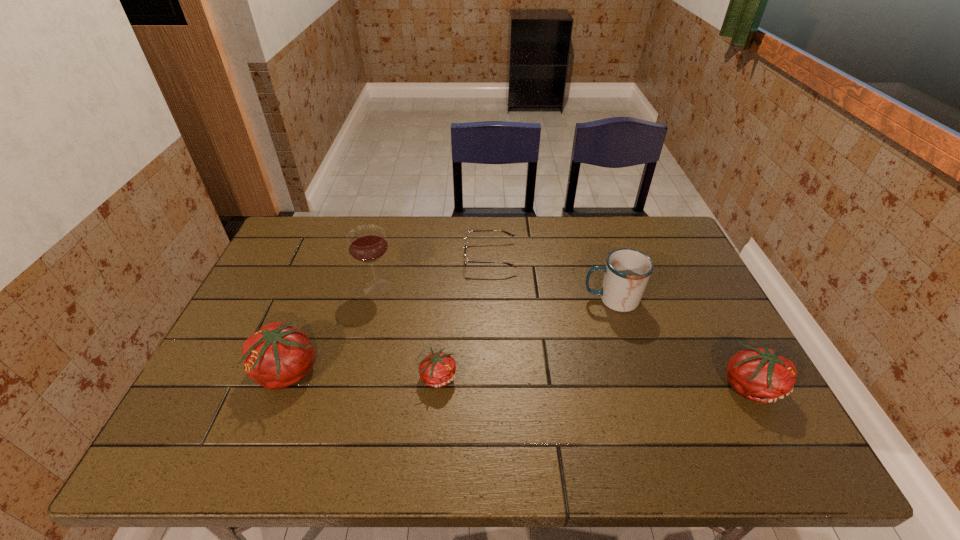
The image size is (960, 540). Find the location of `free space between the rightmost tomato and the farthest object`. free space between the rightmost tomato and the farthest object is located at coordinates (620, 321).

Identify the location of free area in between the second tomato from left to right and the leftmost tomato. (363, 374).

You are a GUI agent. You are given a task and a screenshot of the screen. Output one action in this format:
    pyautogui.click(x=<x>, y=<y>)
    Task: Click on the free spot between the rightmost object and the farthest object
    
    Given the screenshot: What is the action you would take?
    pyautogui.click(x=620, y=321)

Image resolution: width=960 pixels, height=540 pixels. I want to click on free space between the shortest tomato and the fourth object from left to right, so click(465, 316).

The image size is (960, 540). I want to click on free point between the fifth object from right to left and the fifth object from left to right, so click(494, 293).

Locate an element on the screen. This screenshot has height=540, width=960. vacant area between the mug and the third shortest object is located at coordinates (681, 342).

Where is `free space between the shortest object and the rightmost object`? free space between the shortest object and the rightmost object is located at coordinates (620, 321).

Locate an element on the screen. free point between the fifth object from right to left and the rightmost object is located at coordinates (564, 336).

Find the location of `vacant area that lies between the fifth object from right to left and the mug`. vacant area that lies between the fifth object from right to left and the mug is located at coordinates (494, 293).

I want to click on object that stands as the fourth closest to the leftmost object, so pos(627,271).